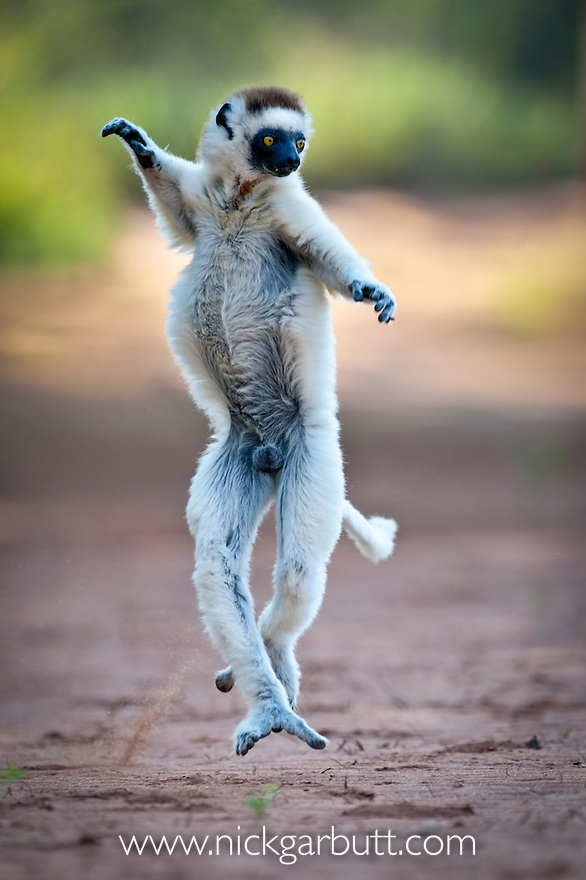
The width and height of the screenshot is (586, 880). What are the coordinates of `chest` in the screenshot? It's located at (230, 243).